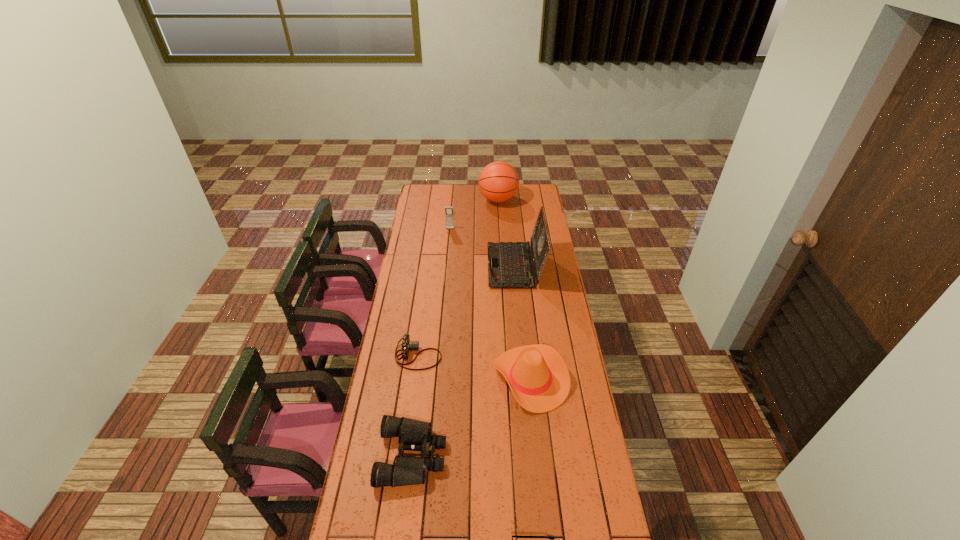
Image resolution: width=960 pixels, height=540 pixels. What are the coordinates of `laptop computer` in the screenshot? It's located at (510, 265).

Locate an element on the screen. the farthest object is located at coordinates (498, 182).

At what (x,y) coordinates should I click in order to perform the action: click on the second farthest object. Please return your answer as a coordinate pair (x, y). Looking at the image, I should click on (449, 217).

The height and width of the screenshot is (540, 960). Find the location of `cowboy hat`. cowboy hat is located at coordinates (538, 377).

The image size is (960, 540). Identify the location of binoculars. (414, 435).

Locate an element on the screen. The image size is (960, 540). the third shortest object is located at coordinates (414, 435).

Image resolution: width=960 pixels, height=540 pixels. I want to click on the second shortest object, so click(x=407, y=345).

This screenshot has height=540, width=960. Find the location of `vacant space located on the screen of the third farthest object`. vacant space located on the screen of the third farthest object is located at coordinates (428, 266).

The image size is (960, 540). I want to click on vacant region located 0.380m on the screen of the third farthest object, so click(417, 266).

This screenshot has height=540, width=960. I want to click on vacant space located 0.250m on the screen of the third farthest object, so click(x=442, y=266).